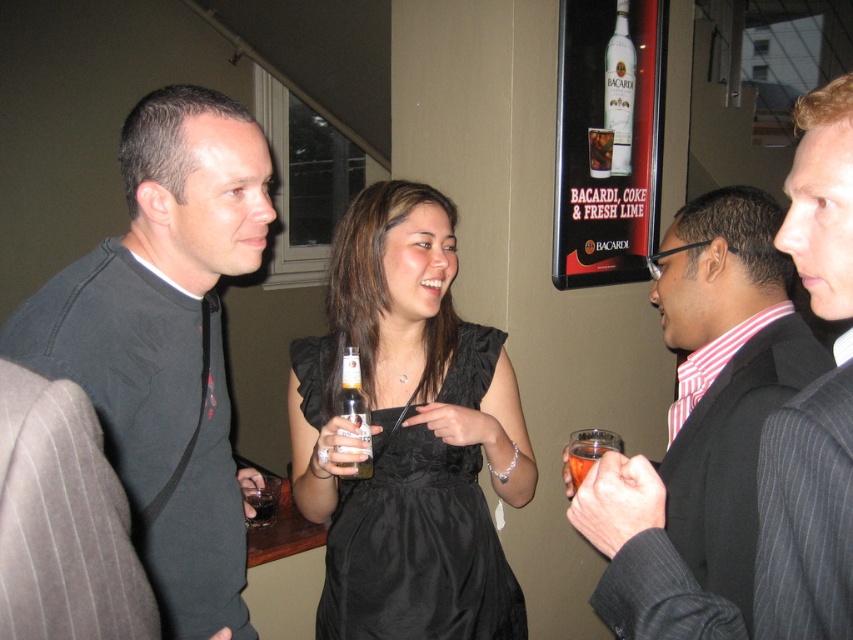
What is the 2D coordinate of the black matte shirt at left in the image?

The 2D coordinate of the black matte shirt at left is at point (167,344).